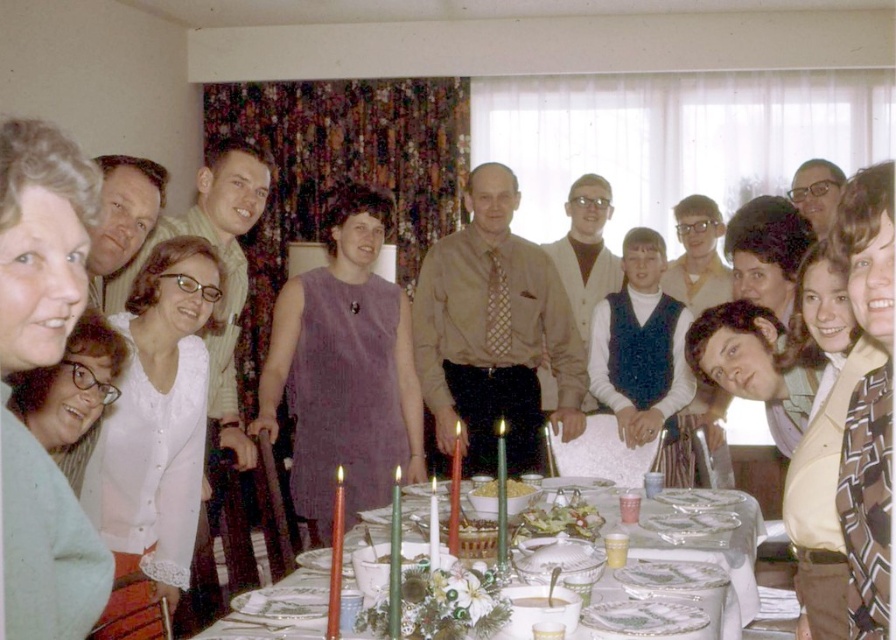
You are a photographer taking a picture of the dining table. You notice the matte white blouse at lower left and the patterned fabric blazer at lower right. Which clothing item is positioned higher on the table?

The matte white blouse at lower left is positioned higher than the patterned fabric blazer at lower right.

You are a photographer at the event and want to capture a photo that includes both the matte white blouse at upper left and the white glossy plates at center. Since both are white, how can you ensure the blouse stands out in the photo?

The matte white blouse at upper left is above the white glossy plates at center, so positioning the camera to focus on the higher area where the blouse is located will help it stand out against the plates below.